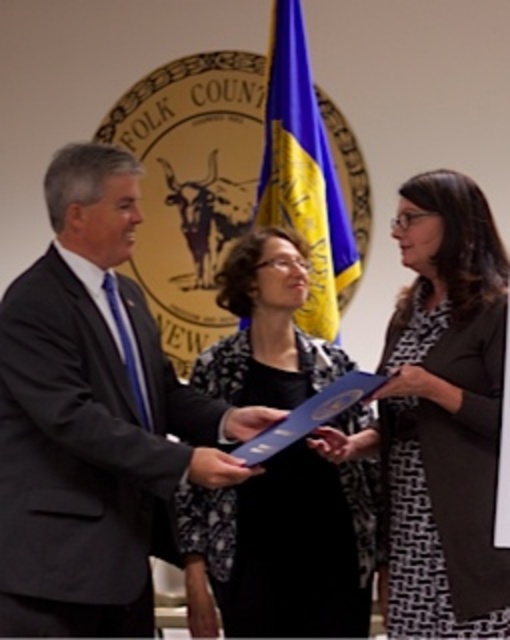
Can you confirm if dark gray suit at center is positioned below matte blue folder at center?

Incorrect, dark gray suit at center is not positioned below matte blue folder at center.

Between dark gray suit at center and matte blue folder at center, which one is positioned higher?

dark gray suit at center

Who is more forward, (100, 611) or (368, 440)?

Point (100, 611)

This screenshot has height=640, width=510. In order to click on dark gray suit at center in this screenshot , I will do [87, 416].

Does point (237, 497) come closer to viewer compared to point (275, 417)?

No, (237, 497) is further to viewer.

Between point (368, 621) and point (239, 417), which one is positioned behind?

Point (239, 417)

Which is in front, point (266, 536) or point (241, 442)?

Positioned in front is point (241, 442).

In order to click on black textured scarf at center in this screenshot , I will do `click(284, 548)`.

From the picture: Can you confirm if dark gray suit at center is thinner than black textured scarf at center?

Correct, dark gray suit at center's width is less than black textured scarf at center's.

Looking at this image, which of these two, dark gray suit at center or black textured scarf at center, stands shorter?

Standing shorter between the two is black textured scarf at center.

Does point (108, 424) come in front of point (343, 552)?

Yes.

Find the location of a particular element. dark gray suit at center is located at coordinates tap(87, 416).